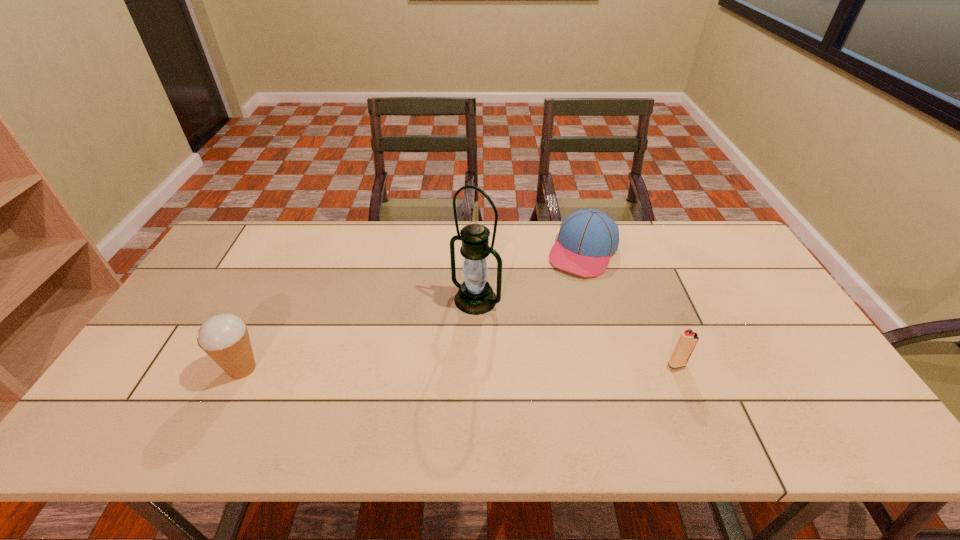
Locate an element on the screen. blank space located on the front-facing side of the second object from right to left is located at coordinates (552, 312).

Locate an element on the screen. vacant space located 0.270m on the front-facing side of the second object from right to left is located at coordinates (539, 335).

This screenshot has width=960, height=540. Find the location of `vacant space located on the side where the tallest object emits light`. vacant space located on the side where the tallest object emits light is located at coordinates (418, 360).

The height and width of the screenshot is (540, 960). Identify the location of free space located 0.270m on the side where the tallest object emits light. (399, 379).

Find the location of a particular element. free space located 0.270m on the side where the tallest object emits light is located at coordinates (x=399, y=379).

Identify the location of object that is at the far edge. Image resolution: width=960 pixels, height=540 pixels. (587, 238).

Find the location of `object that is at the near edge`. object that is at the near edge is located at coordinates (224, 337).

This screenshot has width=960, height=540. In the image, there is a desktop. Find the location of `free space at the far edge`. free space at the far edge is located at coordinates (617, 226).

The image size is (960, 540). I want to click on vacant point at the near edge, so click(x=726, y=383).

You are a GUI agent. You are given a task and a screenshot of the screen. Output one action in this format:
    pyautogui.click(x=<x>, y=<y>)
    Task: Click on the free space at the right edge
    The image size is (960, 540).
    Given the screenshot: What is the action you would take?
    pyautogui.click(x=745, y=329)